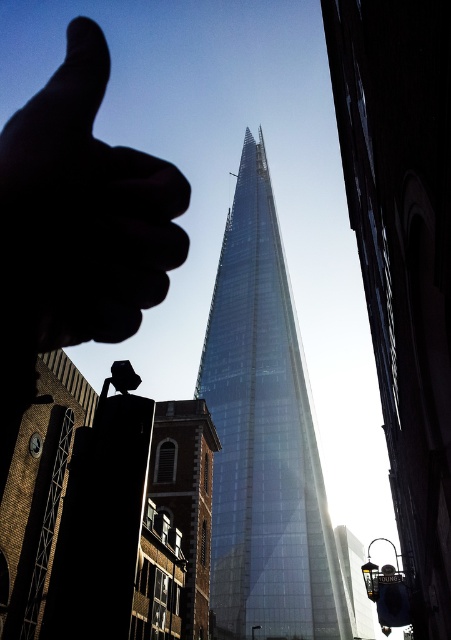
Who is taller, transparent glass tower at center or black matte hand at upper left?

transparent glass tower at center

Between transparent glass tower at center and black matte hand at upper left, which one is positioned higher?

Positioned higher is transparent glass tower at center.

Image resolution: width=451 pixels, height=640 pixels. Describe the element at coordinates (263, 440) in the screenshot. I see `transparent glass tower at center` at that location.

Where is `transparent glass tower at center`? transparent glass tower at center is located at coordinates (263, 440).